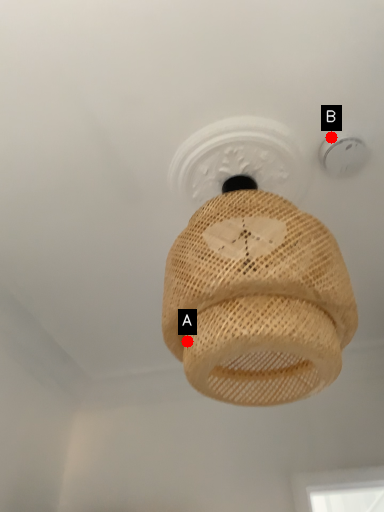
Question: Two points are circled on the image, labeled by A and B beside each circle. Which point appears farthest from the camera in this image?

Choices:
 (A) A is further
 (B) B is further

Answer: (B)